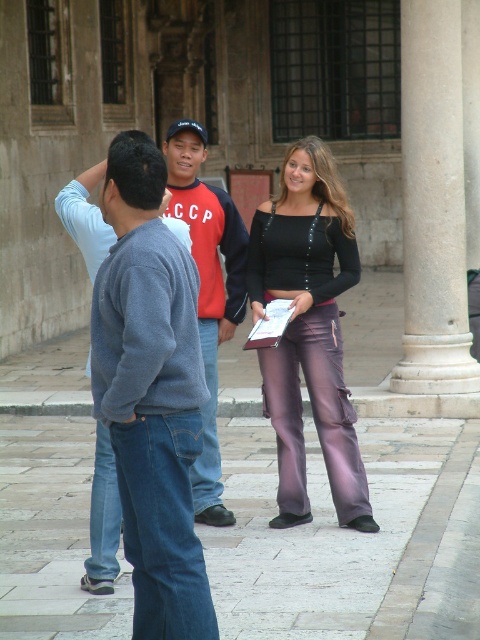
You are a photographer trying to capture a candid shot of the black matte sweatshirt at center without the subject noticing. Since the purple satin pants at center is blocking your view, can you move to the side to get an unobstructed angle?

The purple satin pants at center is in front of the black matte sweatshirt at center, so moving to the side might allow you to see around the purple satin pants at center and capture the black matte sweatshirt at center without being noticed.